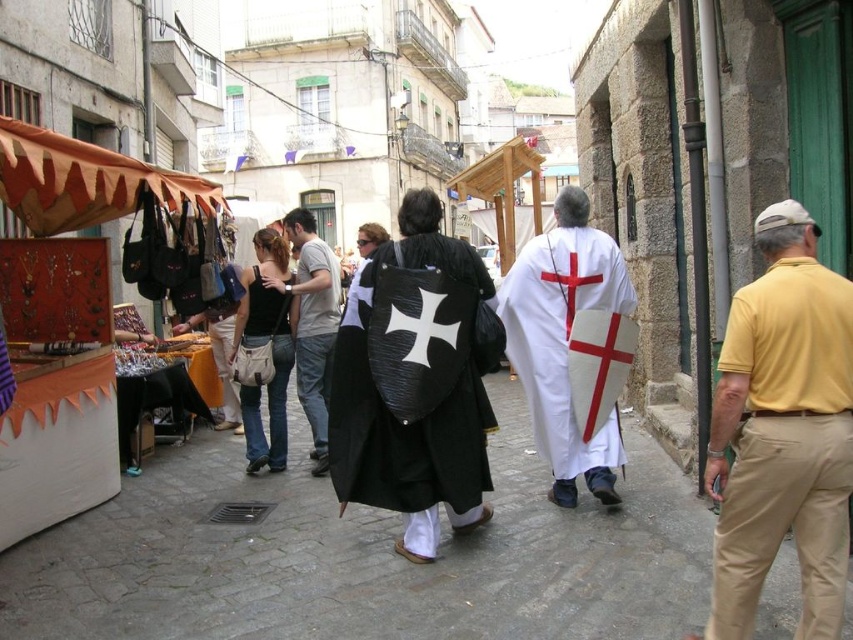
Question: Does white matte robe at center have a larger size compared to light gray cotton t-shirt at center?

Choices:
 (A) yes
 (B) no

Answer: (A)

Question: Is light gray cotton t-shirt at center above white matte shield at center?

Choices:
 (A) yes
 (B) no

Answer: (B)

Question: Does black canvas bag at center lie behind white matte shield at center?

Choices:
 (A) yes
 (B) no

Answer: (A)

Question: Which object is positioned closest to the white matte shield at center?

Choices:
 (A) light gray cotton t-shirt at center
 (B) yellow cotton shirt at right

Answer: (A)

Question: Among these objects, which one is farthest from the camera?

Choices:
 (A) yellow cotton shirt at right
 (B) black canvas bag at center
 (C) black matte shield at center

Answer: (B)

Question: Which of these objects is positioned farthest from the white matte shield at center?

Choices:
 (A) yellow cotton shirt at right
 (B) black canvas bag at center
 (C) black matte shield at center

Answer: (B)